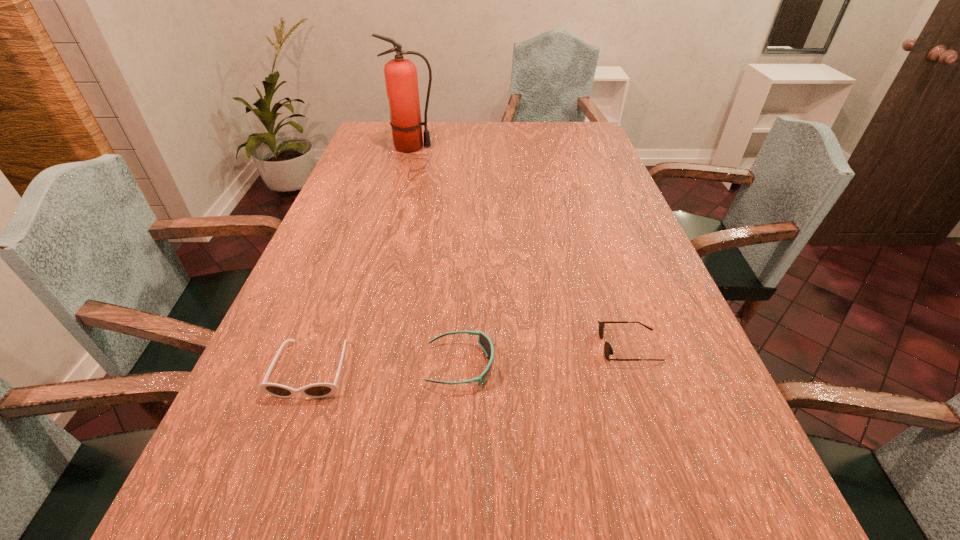
Find the location of a particular element. vacant area that lies between the farthest object and the shortest sunglasses is located at coordinates (521, 247).

Locate which object ranks second in proximity to the shortest sunglasses. Please provide its 2D coordinates. Your answer should be formatted as a tuple, i.e. [(x, y)], where the tuple contains the x and y coordinates of a point satisfying the conditions above.

[(317, 390)]

Where is `the closest object relative to the third object from left to right`? The height and width of the screenshot is (540, 960). the closest object relative to the third object from left to right is located at coordinates (317, 390).

Locate an element on the screen. The width and height of the screenshot is (960, 540). sunglasses identified as the closest to the fire extinguisher is located at coordinates (484, 341).

This screenshot has width=960, height=540. I want to click on the second closest sunglasses relative to the leftmost sunglasses, so click(x=608, y=350).

This screenshot has height=540, width=960. What are the coordinates of `free space that satisfies the following two spatial constraints: 1. on the nozzle of the tallest object; 2. with the lenses of the leftmost sunglasses facing outward` in the screenshot? It's located at (353, 369).

This screenshot has height=540, width=960. I want to click on free region that satisfies the following two spatial constraints: 1. on the front-facing side of the rightmost sunglasses; 2. with the lenses of the leftmost sunglasses facing outward, so click(x=637, y=369).

At what (x,y) coordinates should I click in order to perform the action: click on free spot that satisfies the following two spatial constraints: 1. on the front-facing side of the second sunglasses from left to right; 2. with the lenses of the leftmost sunglasses facing outward. Please return your answer as a coordinate pair (x, y). The width and height of the screenshot is (960, 540). Looking at the image, I should click on (460, 369).

At what (x,y) coordinates should I click in order to perform the action: click on free space in the image that satisfies the following two spatial constraints: 1. on the front-facing side of the shortest sunglasses; 2. with the lenses of the leftmost sunglasses facing outward. Please return your answer as a coordinate pair (x, y). The width and height of the screenshot is (960, 540). Looking at the image, I should click on (637, 369).

Image resolution: width=960 pixels, height=540 pixels. What are the coordinates of `free space that satisfies the following two spatial constraints: 1. on the front-facing side of the second sunglasses from left to right; 2. with the lenses of the leftmost sunglasses facing outward` in the screenshot? It's located at (460, 369).